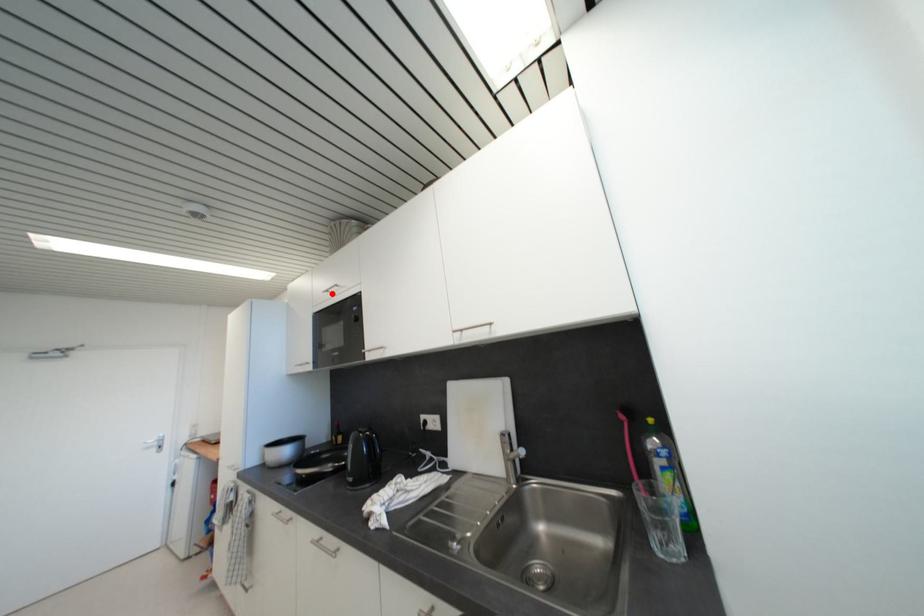
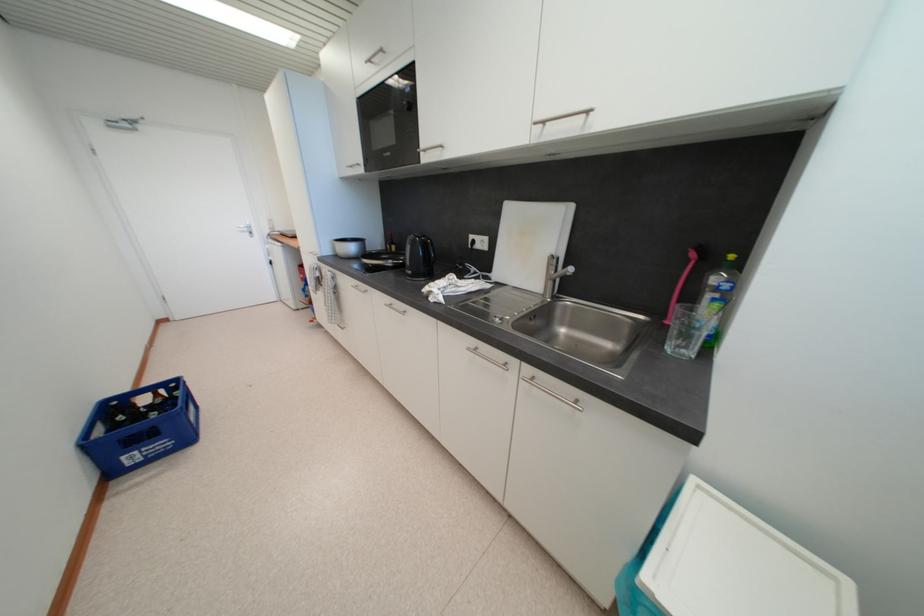
Question: A red point is marked in image1. In image2, is the corresponding 3D point closer to the camera or farther? Reply with the corresponding letter.

Choices:
 (A) The corresponding 3D point is closer.
 (B) The corresponding 3D point is farther.

Answer: (B)